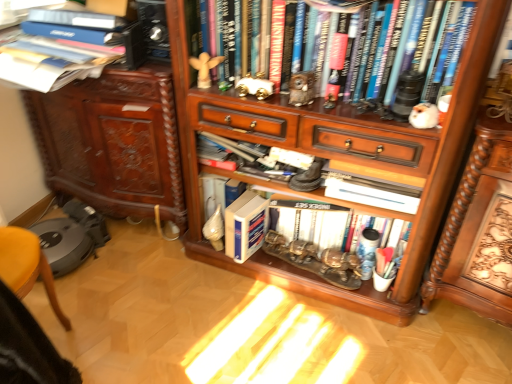
What is the approximate width of hardcover books at upper center, the second book positioned from the top?

hardcover books at upper center, the second book positioned from the top, is 29.28 centimeters in width.

Locate an element on the screen. This screenshot has width=512, height=384. white matte book at center, which is the second book in bottom-to-top order is located at coordinates (321, 236).

What do you see at coordinates (245, 225) in the screenshot?
I see `blue hardcover book at center, the 1th book from the bottom` at bounding box center [245, 225].

The image size is (512, 384). Find the location of `hardcover book at upper left, positioned as the first book in top-to-bottom order`. hardcover book at upper left, positioned as the first book in top-to-bottom order is located at coordinates (77, 19).

The image size is (512, 384). What are the coordinates of `wooden bookcase at center` in the screenshot? It's located at (339, 162).

The width and height of the screenshot is (512, 384). I want to click on wooden cabinet at left, so click(113, 142).

Is wooden carved desk at lower right oriented away from wooden cabinet at left?

That's not correct — wooden carved desk at lower right is not looking away from wooden cabinet at left.

Is wooden carved desk at lower right placed right next to wooden cabinet at left?

There is a gap between wooden carved desk at lower right and wooden cabinet at left.

Is wooden cabinet at left a part of wooden carved desk at lower right?

No, wooden cabinet at left is not inside wooden carved desk at lower right.

Considering the positions of objects hardcover book at upper left, positioned as the first book in top-to-bottom order, and wooden carved desk at lower right in the image provided, who is behind, hardcover book at upper left, positioned as the first book in top-to-bottom order, or wooden carved desk at lower right?

Positioned behind is hardcover book at upper left, positioned as the first book in top-to-bottom order.

Would you say hardcover book at upper left, placed as the fourth book when sorted from bottom to top, is outside wooden carved desk at lower right?

That's correct, hardcover book at upper left, placed as the fourth book when sorted from bottom to top, is outside of wooden carved desk at lower right.

Who is bigger, hardcover book at upper left, positioned as the first book in top-to-bottom order, or wooden carved desk at lower right?

With larger size is wooden carved desk at lower right.

Considering the sizes of hardcover book at upper left, placed as the fourth book when sorted from bottom to top, and wooden carved desk at lower right in the image, is hardcover book at upper left, placed as the fourth book when sorted from bottom to top, wider or thinner than wooden carved desk at lower right?

hardcover book at upper left, placed as the fourth book when sorted from bottom to top, is thinner than wooden carved desk at lower right.

Between blue hardcover book at center, the fourth book from the top, and wooden carved desk at lower right, which one has larger size?

With larger size is wooden carved desk at lower right.

From a real-world perspective, is blue hardcover book at center, the 1th book from the bottom, on wooden carved desk at lower right?

Incorrect, from a real-world perspective, blue hardcover book at center, the 1th book from the bottom, is lower than wooden carved desk at lower right.

Is blue hardcover book at center, the fourth book from the top, not near wooden carved desk at lower right?

That's not correct — blue hardcover book at center, the fourth book from the top, is a little close to wooden carved desk at lower right.

Based on their positions, is blue hardcover book at center, the fourth book from the top, located to the left or right of wooden carved desk at lower right?

blue hardcover book at center, the fourth book from the top, is to the left of wooden carved desk at lower right.

Can you confirm if wooden cabinet at left is smaller than blue hardcover book at center, the 1th book from the bottom?

No.

Considering the positions of point (99, 198) and point (240, 229), is point (99, 198) closer or farther from the camera than point (240, 229)?

Point (99, 198) appears to be farther away from the viewer than point (240, 229).

Based on the photo, considering the sizes of objects wooden cabinet at left and blue hardcover book at center, the fourth book from the top, in the image provided, who is wider, wooden cabinet at left or blue hardcover book at center, the fourth book from the top,?

wooden cabinet at left is wider.

Considering the positions of objects wooden cabinet at left and blue hardcover book at center, the fourth book from the top, in the image provided, who is more to the left, wooden cabinet at left or blue hardcover book at center, the fourth book from the top,?

wooden cabinet at left is more to the left.

Can you confirm if blue hardcover book at center, the fourth book from the top, is wider than hardcover books at upper center, the second book positioned from the top?

No.

Is blue hardcover book at center, the 1th book from the bottom, turned away from hardcover books at upper center, the second book positioned from the top?

No, hardcover books at upper center, the second book positioned from the top, is not at the back of blue hardcover book at center, the 1th book from the bottom.

Does blue hardcover book at center, the 1th book from the bottom, appear on the left side of hardcover books at upper center, the third book positioned from the bottom?

Yes, blue hardcover book at center, the 1th book from the bottom, is to the left of hardcover books at upper center, the third book positioned from the bottom.

How distant is blue hardcover book at center, the fourth book from the top, from hardcover books at upper center, the second book positioned from the top?

blue hardcover book at center, the fourth book from the top, and hardcover books at upper center, the second book positioned from the top, are 25.63 inches apart from each other.

In the image, is hardcover book at upper left, positioned as the first book in top-to-bottom order, positioned in front of or behind white matte book at center, which is the third book in top-to-bottom order?

Visually, hardcover book at upper left, positioned as the first book in top-to-bottom order, is located in front of white matte book at center, which is the third book in top-to-bottom order.

Based on the photo, considering the relative positions of hardcover book at upper left, placed as the fourth book when sorted from bottom to top, and white matte book at center, which is the third book in top-to-bottom order, in the image provided, is hardcover book at upper left, placed as the fourth book when sorted from bottom to top, to the left of white matte book at center, which is the third book in top-to-bottom order, from the viewer's perspective?

Indeed, hardcover book at upper left, placed as the fourth book when sorted from bottom to top, is positioned on the left side of white matte book at center, which is the third book in top-to-bottom order.

Considering the sizes of objects hardcover book at upper left, positioned as the first book in top-to-bottom order, and white matte book at center, which is the third book in top-to-bottom order, in the image provided, who is taller, hardcover book at upper left, positioned as the first book in top-to-bottom order, or white matte book at center, which is the third book in top-to-bottom order,?

Standing taller between the two is white matte book at center, which is the third book in top-to-bottom order.

Is point (28, 15) closer to viewer compared to point (321, 224)?

Yes, it is in front of point (321, 224).

In the image, is white matte book at center, which is the third book in top-to-bottom order, positioned in front of or behind hardcover books at upper center, the second book positioned from the top?

Clearly, white matte book at center, which is the third book in top-to-bottom order, is behind hardcover books at upper center, the second book positioned from the top.

From the image's perspective, which is below, white matte book at center, which is the third book in top-to-bottom order, or hardcover books at upper center, the second book positioned from the top?

white matte book at center, which is the third book in top-to-bottom order, is shown below in the image.

How different are the orientations of white matte book at center, which is the third book in top-to-bottom order, and hardcover books at upper center, the second book positioned from the top, in degrees?

The angular difference between white matte book at center, which is the third book in top-to-bottom order, and hardcover books at upper center, the second book positioned from the top, is 0.000585 degrees.

Are white matte book at center, which is the third book in top-to-bottom order, and hardcover books at upper center, the third book positioned from the bottom, located far from each other?

white matte book at center, which is the third book in top-to-bottom order, is actually quite close to hardcover books at upper center, the third book positioned from the bottom.

This screenshot has height=384, width=512. There is a wooden carved desk at lower right. What are the coordinates of `cabinetry above it (from a real-world perspective)` in the screenshot? It's located at (113, 142).

Where is `computer desk below the hardcover book at upper left, positioned as the first book in top-to-bottom order (from a real-world perspective)`? computer desk below the hardcover book at upper left, positioned as the first book in top-to-bottom order (from a real-world perspective) is located at coordinates (477, 230).

Which object lies nearer to the anchor point wooden bookcase at center, hardcover books at upper center, the second book positioned from the top, or white matte book at center, which is the second book in bottom-to-top order?

Based on the image, white matte book at center, which is the second book in bottom-to-top order, appears to be nearer to wooden bookcase at center.

Based on their spatial positions, is wooden cabinet at left or wooden bookcase at center further from white matte book at center, which is the third book in top-to-bottom order?

wooden cabinet at left.

Considering their positions, is white matte book at center, which is the third book in top-to-bottom order, positioned further to wooden carved desk at lower right than blue hardcover book at center, the 1th book from the bottom?

Based on the image, blue hardcover book at center, the 1th book from the bottom, appears to be further to wooden carved desk at lower right.

Estimate the real-world distances between objects in this image. Which object is further from white matte book at center, which is the third book in top-to-bottom order, blue hardcover book at center, the fourth book from the top, or hardcover book at upper left, positioned as the first book in top-to-bottom order?

hardcover book at upper left, positioned as the first book in top-to-bottom order.

Looking at the image, which one is located closer to blue hardcover book at center, the 1th book from the bottom, wooden cabinet at left or hardcover books at upper center, the third book positioned from the bottom?

wooden cabinet at left is closer to blue hardcover book at center, the 1th book from the bottom.

When comparing their distances from hardcover books at upper center, the third book positioned from the bottom, does wooden cabinet at left or wooden carved desk at lower right seem closer?

wooden carved desk at lower right.

Considering their positions, is wooden bookcase at center positioned further to wooden carved desk at lower right than hardcover books at upper center, the second book positioned from the top?

The object further to wooden carved desk at lower right is hardcover books at upper center, the second book positioned from the top.

Estimate the real-world distances between objects in this image. Which object is further from wooden bookcase at center, hardcover book at upper left, positioned as the first book in top-to-bottom order, or hardcover books at upper center, the second book positioned from the top?

hardcover book at upper left, positioned as the first book in top-to-bottom order, is positioned further to the anchor wooden bookcase at center.

Find the location of `bookcase located between blue hardcover book at center, the 1th book from the bottom, and wooden carved desk at lower right in the left-right direction`. bookcase located between blue hardcover book at center, the 1th book from the bottom, and wooden carved desk at lower right in the left-right direction is located at coordinates (339, 162).

Find the location of a particular element. book between hardcover books at upper center, the second book positioned from the top, and blue hardcover book at center, the fourth book from the top, in the up-down direction is located at coordinates (321, 236).

This screenshot has height=384, width=512. I want to click on bookcase between white matte book at center, which is the second book in bottom-to-top order, and wooden carved desk at lower right, so click(x=339, y=162).

This screenshot has height=384, width=512. Identify the location of book between white matte book at center, which is the second book in bottom-to-top order, and wooden carved desk at lower right, in the horizontal direction. click(x=397, y=50).